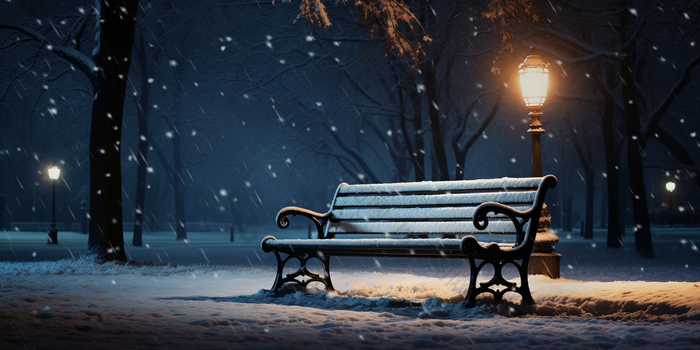
You are a GUI agent. You are given a task and a screenshot of the screen. Output one action in this format:
    pyautogui.click(x=<x>, y=<y>)
    Task: Click on the chair
    The height and width of the screenshot is (350, 700).
    Given the screenshot: What is the action you would take?
    pyautogui.click(x=525, y=91), pyautogui.click(x=388, y=196)